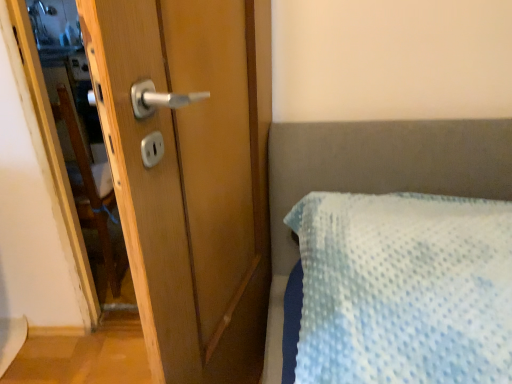
The height and width of the screenshot is (384, 512). What do you see at coordinates (190, 175) in the screenshot?
I see `wooden door at left` at bounding box center [190, 175].

At what (x,y) coordinates should I click in order to perform the action: click on wooden door at left. Please return your answer as a coordinate pair (x, y). This screenshot has height=384, width=512. Looking at the image, I should click on (190, 175).

Identify the location of wooden door at left. (190, 175).